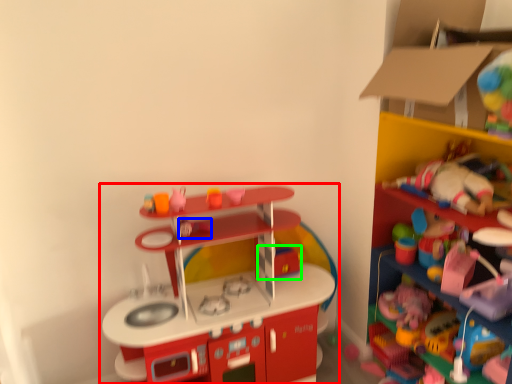
Question: Estimate the real-world distances between objects in this image. Which object is closer to toy (highlighted by a red box), toy (highlighted by a blue box) or toy (highlighted by a green box)?

Choices:
 (A) toy
 (B) toy

Answer: (B)